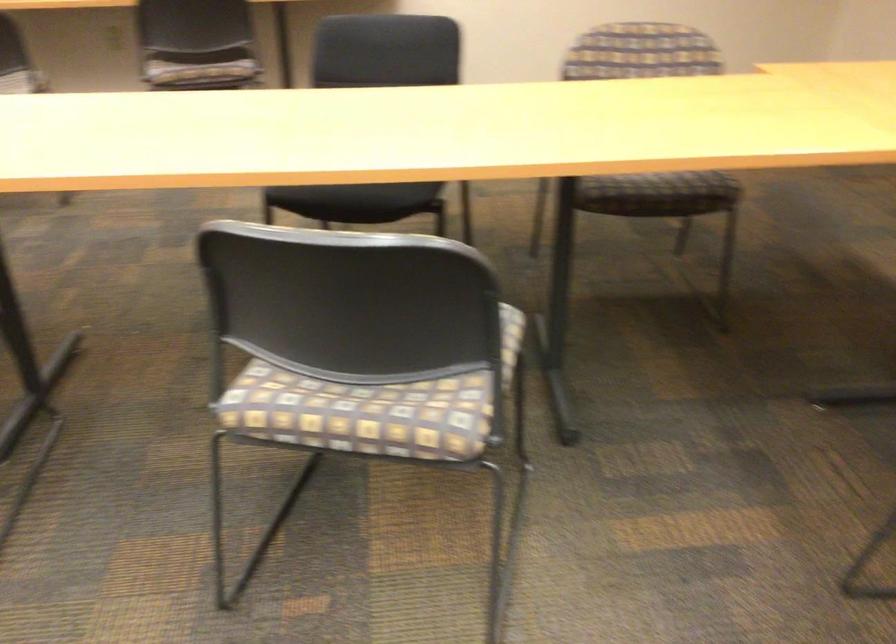
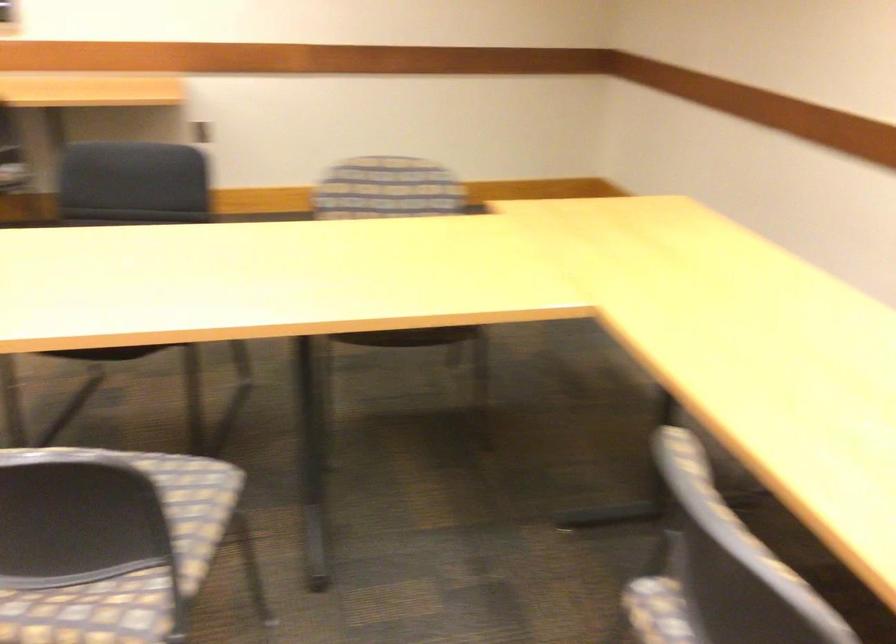
Question: I am providing you with two images of the same scene from different viewpoints. Please identify which objects are invisible in image2.

Choices:
 (A) cushioned chair sitting surface
 (B) striped chair sitting surface
 (C) dark chair sitting surface
 (D) red potted cactus

Answer: (A)